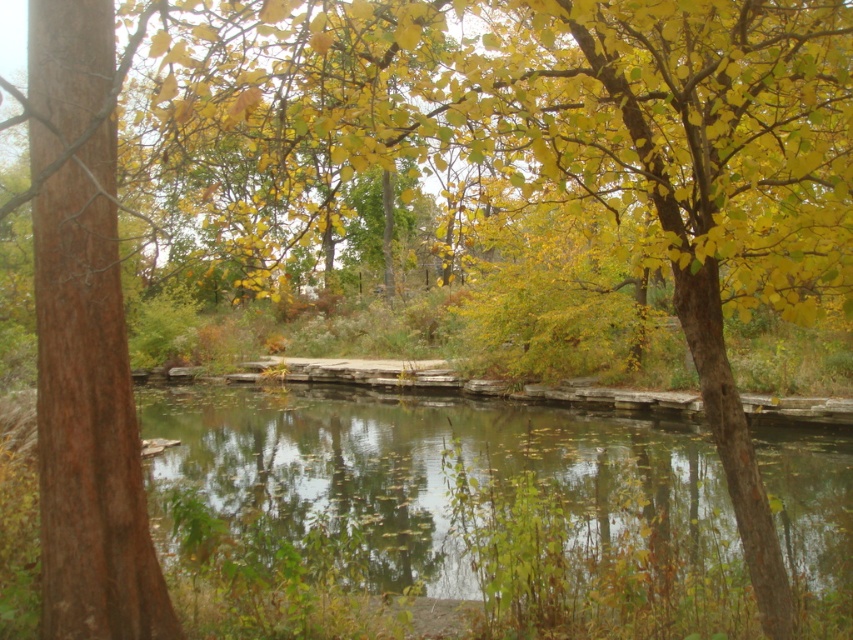
You are a painter standing at the edge of the pond. You want to paint the brown rough bark tree at left and the clear water at center. Which object should you focus on first if you want to paint the taller one first?

The brown rough bark tree at left is taller than the clear water at center, so you should focus on painting the brown rough bark tree at left first.

Consider the image. You are standing at the edge of the pond and want to find the clear water at center. According to the coordinates provided, where should you look relative to the center of the image?

The clear water at center is located at coordinates point (x=434, y=470), which means it is slightly to the right and slightly below the center of the image.